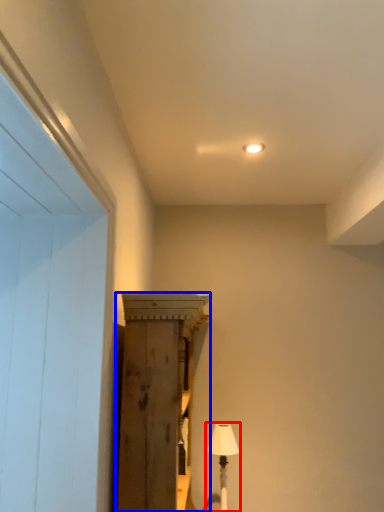
Question: Which point is closer to the camera, table lamp (highlighted by a red box) or cabinetry (highlighted by a blue box)?

Choices:
 (A) table lamp
 (B) cabinetry

Answer: (B)